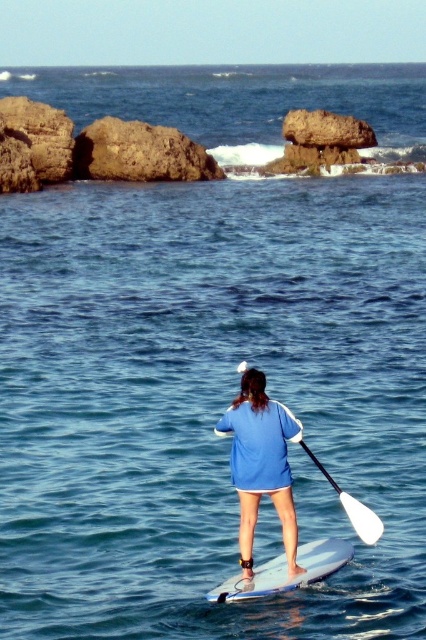
Is point (285, 547) more distant than point (371, 513)?

Yes, point (285, 547) is farther from viewer.

Does blue fabric shirt at center have a greater height compared to white plastic paddle at center?

Indeed, blue fabric shirt at center has a greater height compared to white plastic paddle at center.

Which is behind, point (290, 547) or point (360, 525)?

The point (360, 525) is more distant.

Where is `blue fabric shirt at center`? This screenshot has width=426, height=640. blue fabric shirt at center is located at coordinates (261, 464).

Can you confirm if blue fabric shirt at center is thinner than white foam surfboard at center?

Yes.

Who is positioned more to the right, blue fabric shirt at center or white foam surfboard at center?

Positioned to the right is white foam surfboard at center.

This screenshot has width=426, height=640. What do you see at coordinates (261, 464) in the screenshot? I see `blue fabric shirt at center` at bounding box center [261, 464].

The height and width of the screenshot is (640, 426). Identify the location of blue fabric shirt at center. (261, 464).

Does point (256, 576) come closer to viewer compared to point (371, 513)?

That is False.

How distant is white foam surfboard at center from white plastic paddle at center?

white foam surfboard at center and white plastic paddle at center are 33.41 inches apart.

Does point (256, 568) come behind point (344, 499)?

That is True.

Image resolution: width=426 pixels, height=640 pixels. I want to click on white foam surfboard at center, so click(x=287, y=572).